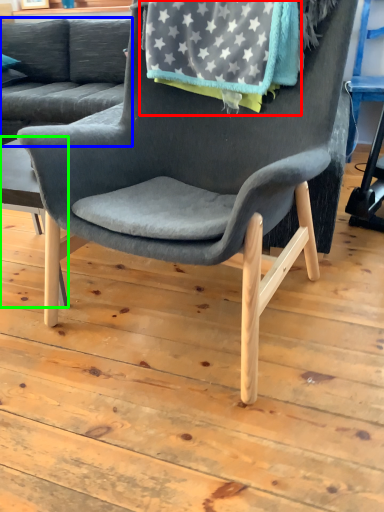
Question: Estimate the real-world distances between objects in this image. Which object is farther from blanket (highlighted by a red box), studio couch (highlighted by a blue box) or table (highlighted by a green box)?

Choices:
 (A) studio couch
 (B) table

Answer: (A)